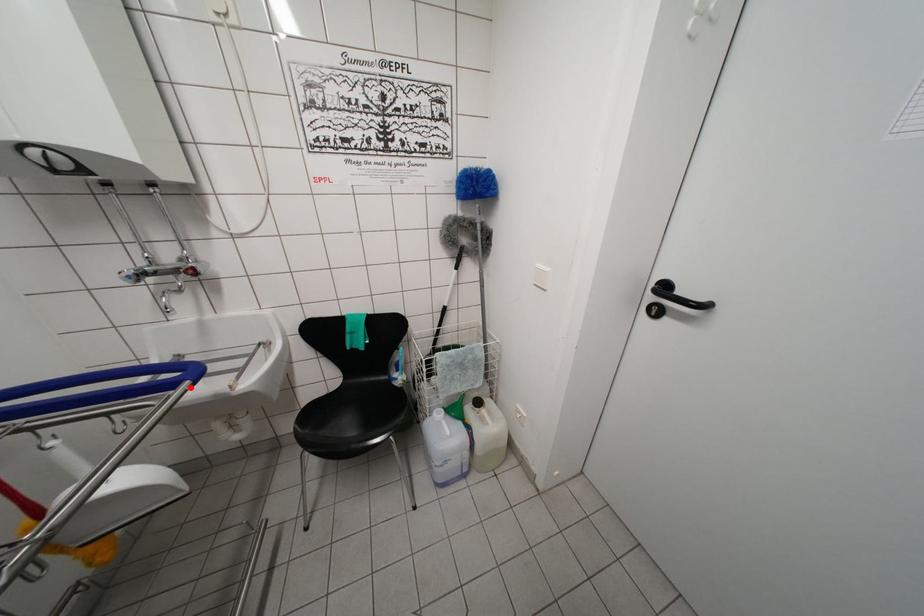
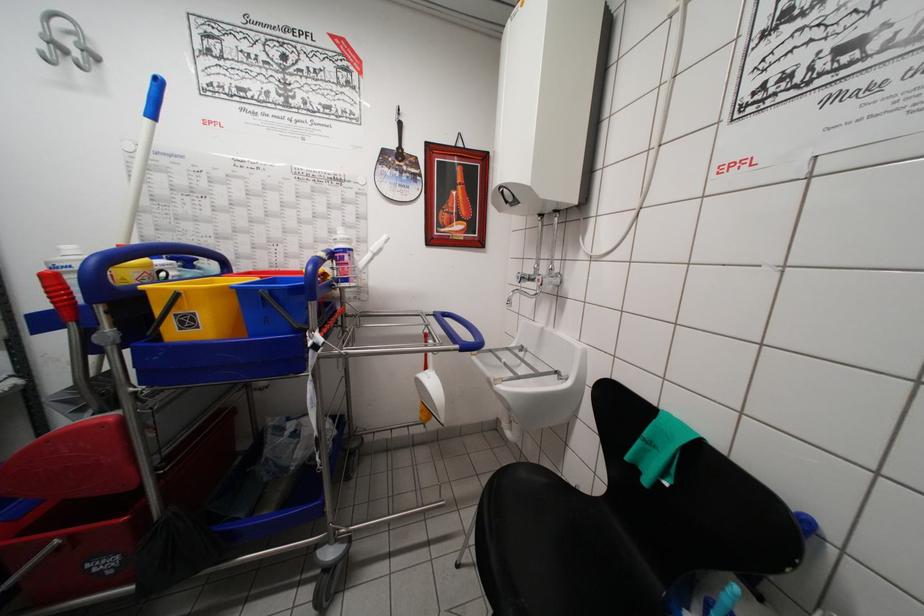
The point at the highlighted location is marked in the first image. Where is the corresponding point in the second image?

(460, 351)